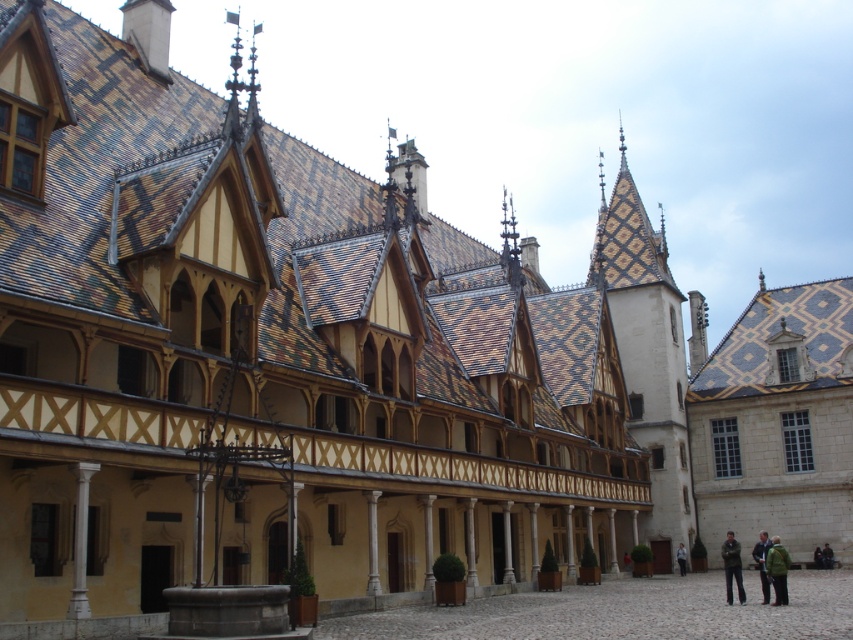
Question: Which object appears closest to the camera in this image?

Choices:
 (A) green fabric jacket at lower right
 (B) light brown leather jacket at lower right
 (C) dark blue jacket at lower right

Answer: (C)

Question: Can you confirm if dark gray jacket at lower right is positioned above green fabric jacket at lower right?

Choices:
 (A) yes
 (B) no

Answer: (A)

Question: Among these points, which one is farthest from the camera?

Choices:
 (A) (728, 589)
 (B) (764, 547)

Answer: (B)

Question: Considering the relative positions of green fuzzy jacket at lower right and green fabric jacket at lower right in the image provided, where is green fuzzy jacket at lower right located with respect to green fabric jacket at lower right?

Choices:
 (A) above
 (B) below

Answer: (A)

Question: Based on their relative distances, which object is nearer to the green fabric jacket at lower right?

Choices:
 (A) light brown leather jacket at lower right
 (B) dark blue jacket at lower right

Answer: (A)

Question: Is green fuzzy jacket at lower right thinner than green fabric jacket at lower right?

Choices:
 (A) no
 (B) yes

Answer: (A)